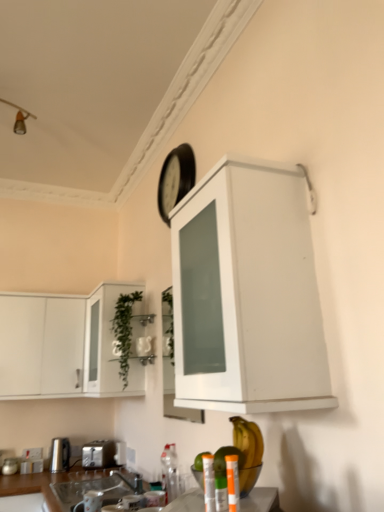
Question: Considering the relative positions of yellow matte banana at lower center and metallic silver can at lower center, which is counted as the first bottle, starting from the left, in the image provided, is yellow matte banana at lower center to the left of metallic silver can at lower center, which is counted as the first bottle, starting from the left, from the viewer's perspective?

Choices:
 (A) yes
 (B) no

Answer: (B)

Question: Would you say yellow matte banana at lower center is outside metallic silver can at lower center, arranged as the second bottle when viewed from the right?

Choices:
 (A) yes
 (B) no

Answer: (A)

Question: Does yellow matte banana at lower center lie in front of metallic silver can at lower center, arranged as the second bottle when viewed from the right?

Choices:
 (A) no
 (B) yes

Answer: (A)

Question: Is yellow matte banana at lower center facing away from metallic silver can at lower center, which is counted as the first bottle, starting from the left?

Choices:
 (A) no
 (B) yes

Answer: (A)

Question: Is metallic silver can at lower center, which is counted as the first bottle, starting from the left, inside yellow matte banana at lower center?

Choices:
 (A) no
 (B) yes

Answer: (A)

Question: From a real-world perspective, is white matte cabinet at upper center, arranged as the first cabinetry when viewed from the right, above or below yellow matte banana at lower center?

Choices:
 (A) above
 (B) below

Answer: (A)

Question: In terms of size, does white matte cabinet at upper center, arranged as the first cabinetry when viewed from the right, appear bigger or smaller than yellow matte banana at lower center?

Choices:
 (A) small
 (B) big

Answer: (B)

Question: Considering the positions of point (205, 278) and point (249, 483), is point (205, 278) closer or farther from the camera than point (249, 483)?

Choices:
 (A) farther
 (B) closer

Answer: (A)

Question: Considering their positions, is white matte cabinet at upper center, arranged as the first cabinetry when viewed from the right, located in front of or behind yellow matte banana at lower center?

Choices:
 (A) behind
 (B) front

Answer: (B)

Question: Does point (231, 458) appear closer or farther from the camera than point (69, 502)?

Choices:
 (A) closer
 (B) farther

Answer: (A)

Question: Is translucent plastic bottle at lower center, the 1th bottle viewed from the right, in front of or behind clear glass sink at lower center in the image?

Choices:
 (A) front
 (B) behind

Answer: (A)

Question: Would you say translucent plastic bottle at lower center, the second bottle viewed from the left, is to the left or to the right of clear glass sink at lower center in the picture?

Choices:
 (A) right
 (B) left

Answer: (A)

Question: Based on their sizes in the image, would you say translucent plastic bottle at lower center, the 1th bottle viewed from the right, is bigger or smaller than clear glass sink at lower center?

Choices:
 (A) big
 (B) small

Answer: (B)

Question: In the image, is translucent plastic bottle at lower center, the 1th bottle viewed from the right, on the left side or the right side of green glass cabinet at left, positioned as the second cabinetry in left-to-right order?

Choices:
 (A) left
 (B) right

Answer: (B)

Question: Does point (233, 481) appear closer or farther from the camera than point (97, 353)?

Choices:
 (A) closer
 (B) farther

Answer: (A)